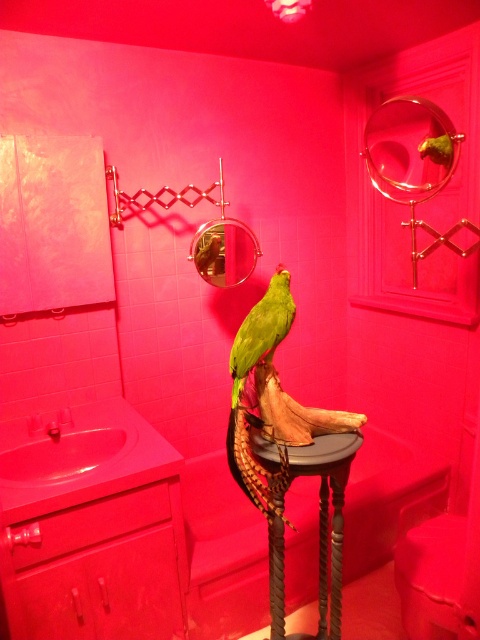
You are a small toy that is 10 cm tall. You want to place yourself on the wooden pedestal at center and the green matte parrot at center. Which object can you fit on?

The wooden pedestal at center has a larger size compared to the green matte parrot at center, so the toy can fit on the wooden pedestal at center.

You are a photographer holding a camera. You want to take a photo of the wooden pedestal at center from a distance of 1.5 meters. Can you position yourself correctly based on the scene?

The wooden pedestal at center and camera are 1.45 meters apart, so you need to move back slightly to reach the desired 1.5 meters distance.